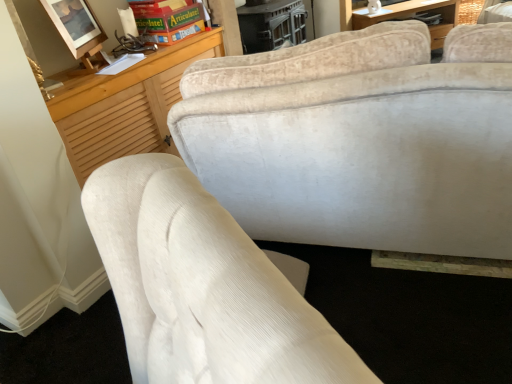
Question: In terms of width, does green cardboard game at upper center look wider or thinner when compared to matte wooden picture frame at upper left?

Choices:
 (A) wide
 (B) thin

Answer: (A)

Question: From a real-world perspective, is green cardboard game at upper center physically located above or below matte wooden picture frame at upper left?

Choices:
 (A) above
 (B) below

Answer: (B)

Question: Is point click(x=154, y=33) closer or farther from the camera than point click(x=89, y=51)?

Choices:
 (A) closer
 (B) farther

Answer: (B)

Question: Considering the positions of matte wooden picture frame at upper left and green cardboard game at upper center in the image, is matte wooden picture frame at upper left taller or shorter than green cardboard game at upper center?

Choices:
 (A) tall
 (B) short

Answer: (A)

Question: Considering the positions of matte wooden picture frame at upper left and green cardboard game at upper center in the image, is matte wooden picture frame at upper left bigger or smaller than green cardboard game at upper center?

Choices:
 (A) small
 (B) big

Answer: (A)

Question: From a real-world perspective, is matte wooden picture frame at upper left positioned above or below green cardboard game at upper center?

Choices:
 (A) below
 (B) above

Answer: (B)

Question: Visually, is matte wooden picture frame at upper left positioned to the left or to the right of green cardboard game at upper center?

Choices:
 (A) right
 (B) left

Answer: (B)